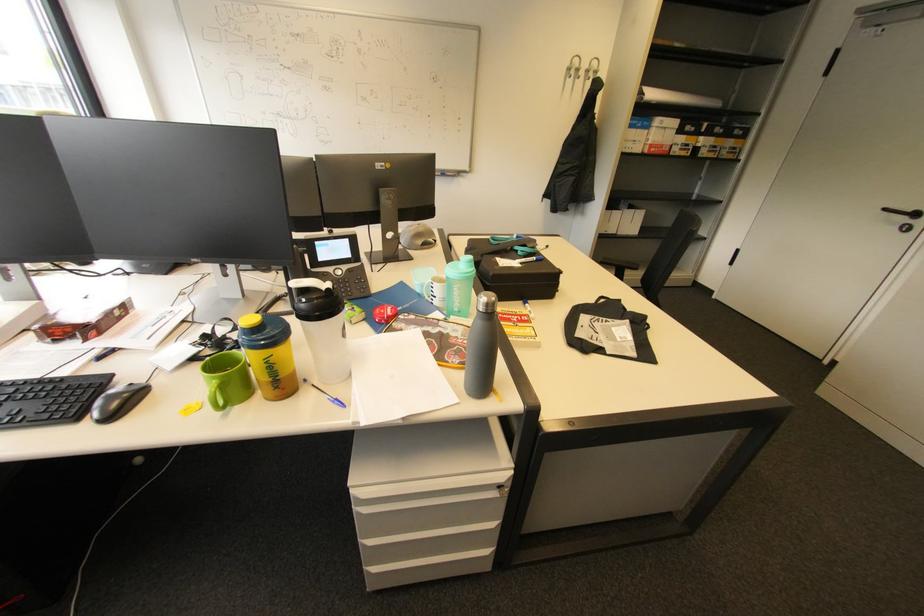
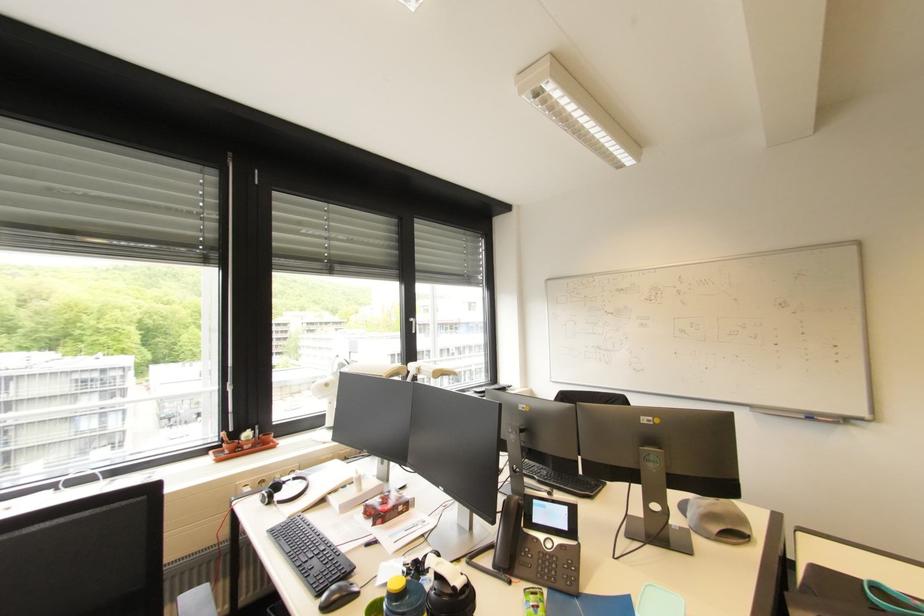
Locate, in the second image, the point that corresponds to point 445,175 in the first image.

(808, 418)